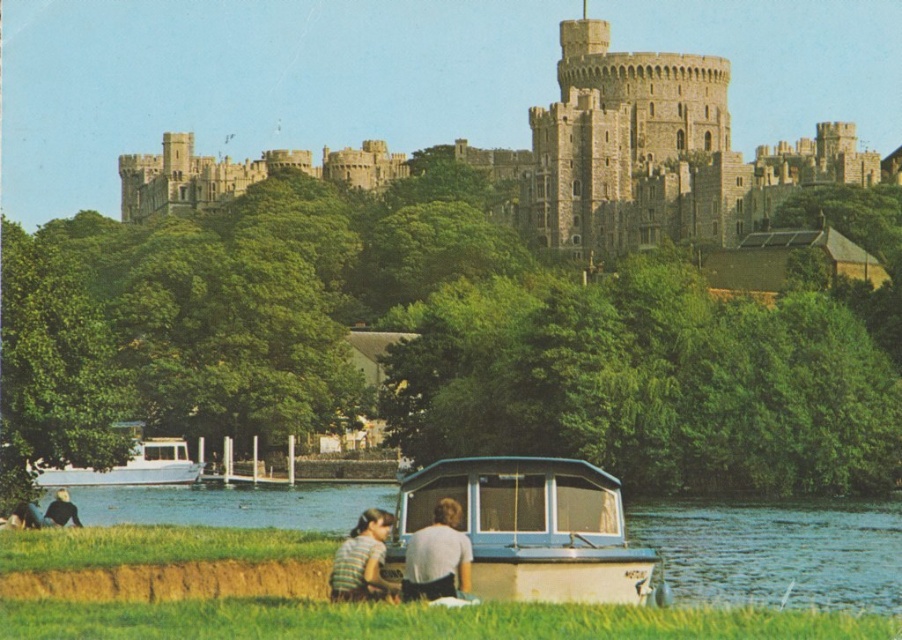
Question: Which of the following is the closest to the observer?

Choices:
 (A) striped shirt at lower center
 (B) striped cotton shirt at lower center

Answer: (B)

Question: Among these points, which one is farthest from the camera?

Choices:
 (A) (440, 550)
 (B) (22, 524)
 (C) (30, 509)
 (D) (167, 464)

Answer: (D)

Question: Is blue water at lower center wider than striped shirt at lower center?

Choices:
 (A) yes
 (B) no

Answer: (A)

Question: Is stone castle at upper center to the right of light brown hair at lower left from the viewer's perspective?

Choices:
 (A) no
 (B) yes

Answer: (B)

Question: Is blue water at lower center positioned before white glossy boat at lower left?

Choices:
 (A) yes
 (B) no

Answer: (A)

Question: Considering the real-world distances, which object is closest to the light brown hair at lower left?

Choices:
 (A) striped cotton shirt at lower center
 (B) stone castle at upper center
 (C) dark brown leather jacket at lower left

Answer: (C)